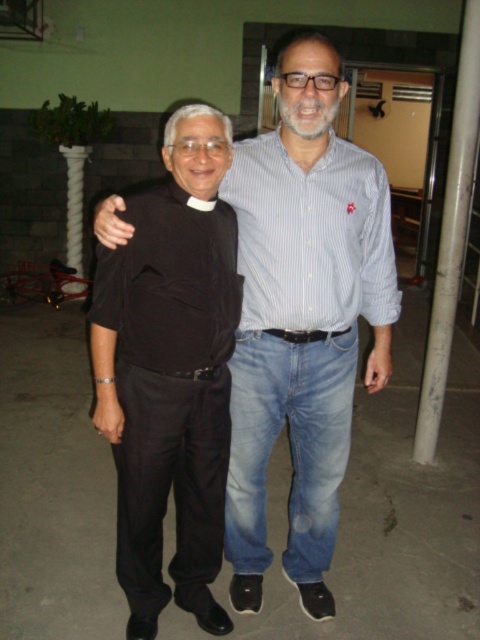
You are a photographer trying to capture a portrait of both the black matte shirt at center and the blue striped shirt at center. Since the camera can only focus on one subject at a time, which subject should you focus on first to ensure the other is still in the frame?

The black matte shirt at center is below the blue striped shirt at center, so you should focus on the blue striped shirt at center first as it is higher up, ensuring the lower black matte shirt at center remains within the frame.

You are standing in front of the beige door and want to place a small plant pot between the two points labeled point (x=227, y=269) and point (x=371, y=168). Which point should the plant pot be closer to in order to be nearer to the viewer?

The plant pot should be placed closer to point (x=227, y=269) because it is closer to the viewer than point (x=371, y=168).

You are a photographer trying to capture both the black matte shirt at center and the blue striped shirt at center in a single frame. Since you want both shirts to appear equally prominent, which shirt should you move closer to the camera?

The black matte shirt at center is bigger than the blue striped shirt at center. To make both shirts appear equally prominent in the photo, you should move the blue striped shirt at center closer to the camera.